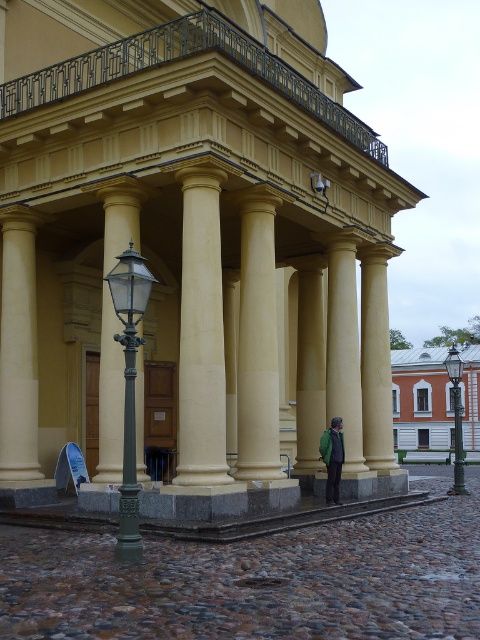
Find the location of a particular element. This screenshot has width=480, height=640. smooth cream-colored column at center is located at coordinates (375, 358).

Can you confirm if smooth cream-colored column at center is thinner than green fabric jacket at lower center?

Yes.

Image resolution: width=480 pixels, height=640 pixels. Identify the location of smooth cream-colored column at center. (375, 358).

Who is shorter, green fabric jacket at lower center or metallic streetlamp at center?

metallic streetlamp at center is shorter.

Which is below, green fabric jacket at lower center or metallic streetlamp at center?

green fabric jacket at lower center is lower down.

Describe the element at coordinates (333, 458) in the screenshot. I see `green fabric jacket at lower center` at that location.

Identify the location of green fabric jacket at lower center. This screenshot has height=640, width=480. (333, 458).

Can you confirm if matte yellow stone columns at center is positioned to the left of green fabric jacket at lower center?

Correct, you'll find matte yellow stone columns at center to the left of green fabric jacket at lower center.

Is point (72, 404) positioned after point (342, 452)?

Yes, it is.

Describe the element at coordinates (178, 236) in the screenshot. I see `matte yellow stone columns at center` at that location.

Where is `matte yellow stone columns at center`? Image resolution: width=480 pixels, height=640 pixels. matte yellow stone columns at center is located at coordinates (178, 236).